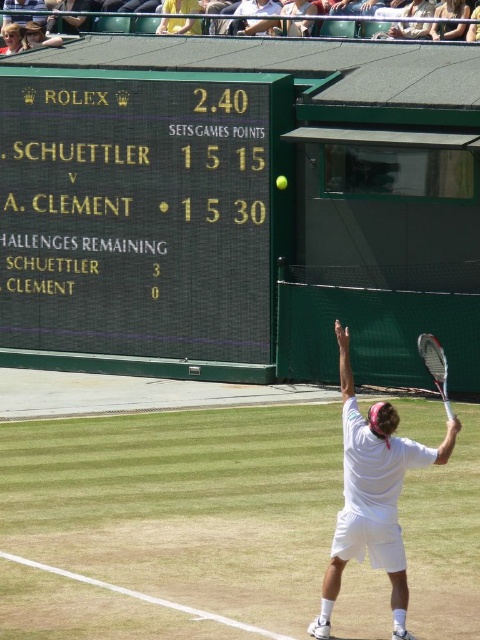
You are a tennis player preparing to return a serve during a Wimbledon match. You notice a point marked at coordinates (377, 484) on the court. Based on the scoreboard and the court layout, where is this point located relative to the white matte tennis racket at upper right?

The point at coordinates (377, 484) indicates the location of the white matte tennis racket at upper right, so the point is exactly where the white matte tennis racket at upper right is positioned.

You are a Wimbledon official and need to place a new scoreboard next to the existing green matte scoreboard at upper left and the white matte tennis racket at upper right. Which object should you place the new scoreboard closer to if you want it to be wider than both?

The green matte scoreboard at upper left might be wider than white matte tennis racket at upper right, so placing the new scoreboard closer to the green matte scoreboard at upper left would ensure it is wider than both.

You are a tennis coach observing the match. You notice the white matte tennis racket at upper right and the yellow rubber tennis ball at center. Which object is taller?

The white matte tennis racket at upper right is much taller than the yellow rubber tennis ball at center.